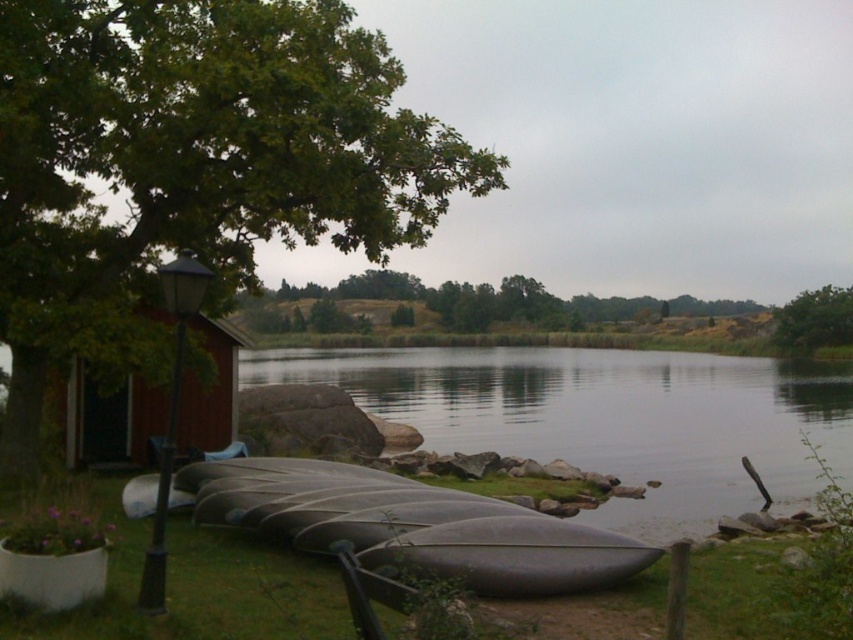
Question: Based on their relative distances, which object is nearer to the green leafy tree at upper left?

Choices:
 (A) brown wooden hut at left
 (B) gray rubber canoe at center
 (C) green grass at lower center

Answer: (A)

Question: Can you confirm if transparent water at center is positioned to the left of matte black canoe at lower center?

Choices:
 (A) no
 (B) yes

Answer: (A)

Question: Which object is closer to the camera taking this photo?

Choices:
 (A) green grass at lower center
 (B) green leafy tree at upper left

Answer: (A)

Question: Is transparent water at center wider than green leafy tree at upper right?

Choices:
 (A) no
 (B) yes

Answer: (B)

Question: Considering the relative positions of green grass at lower center and matte black canoe at lower center in the image provided, where is green grass at lower center located with respect to matte black canoe at lower center?

Choices:
 (A) right
 (B) left

Answer: (B)

Question: Which of the following is the farthest from the observer?

Choices:
 (A) (155, 317)
 (B) (836, 468)
 (C) (322, 544)
 (D) (815, 304)

Answer: (D)